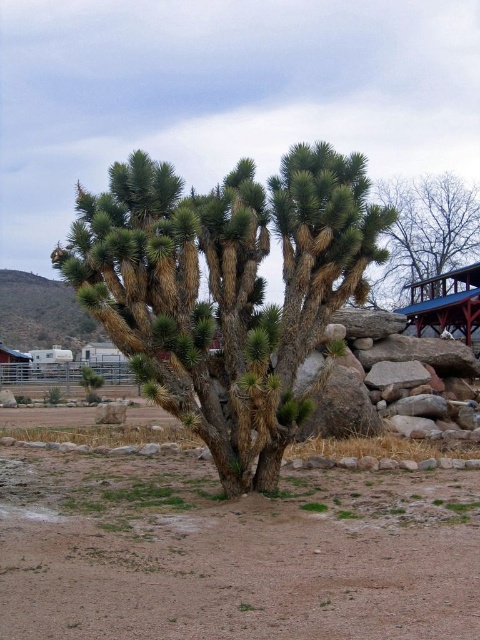
Based on the photo, is green spiky tree at center closer to the viewer compared to brown textured tree at upper right?

Yes.

Can you confirm if green spiky tree at center is wider than brown textured tree at upper right?

No.

Does point (273, 438) come farther from viewer compared to point (398, 234)?

No, (273, 438) is in front of (398, 234).

The image size is (480, 640). Find the location of `green spiky tree at center`. green spiky tree at center is located at coordinates (226, 291).

Between brown sandy dirt at center and green spiky tree at center, which one appears on the right side from the viewer's perspective?

brown sandy dirt at center is more to the right.

From the picture: Who is lower down, brown sandy dirt at center or green spiky tree at center?

brown sandy dirt at center is below.

Locate an element on the screen. The height and width of the screenshot is (640, 480). brown sandy dirt at center is located at coordinates (232, 552).

Does brown sandy dirt at center come in front of brown textured tree at upper right?

Yes, it is.

Is brown sandy dirt at center to the left of brown textured tree at upper right from the viewer's perspective?

Correct, you'll find brown sandy dirt at center to the left of brown textured tree at upper right.

This screenshot has height=640, width=480. Describe the element at coordinates (232, 552) in the screenshot. I see `brown sandy dirt at center` at that location.

Image resolution: width=480 pixels, height=640 pixels. I want to click on brown sandy dirt at center, so click(232, 552).